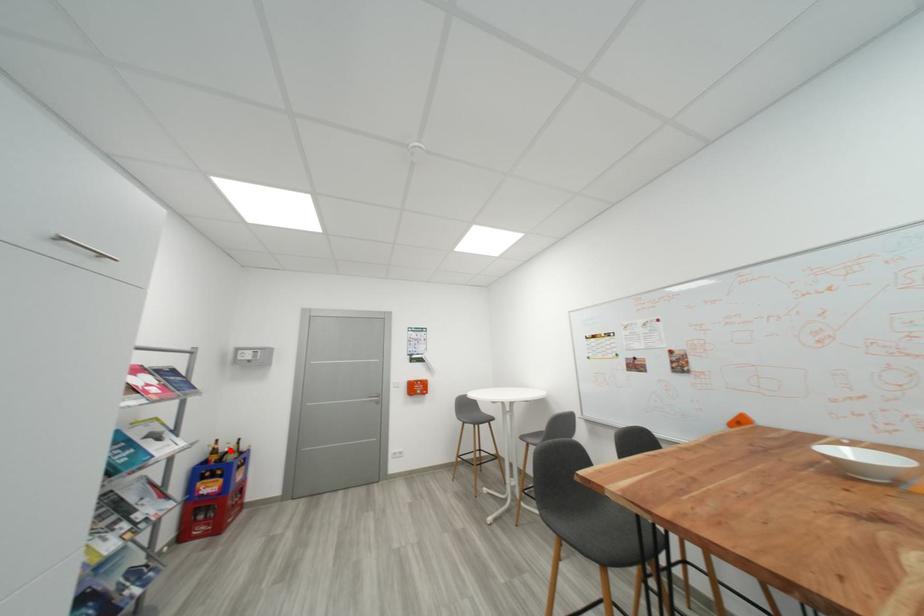
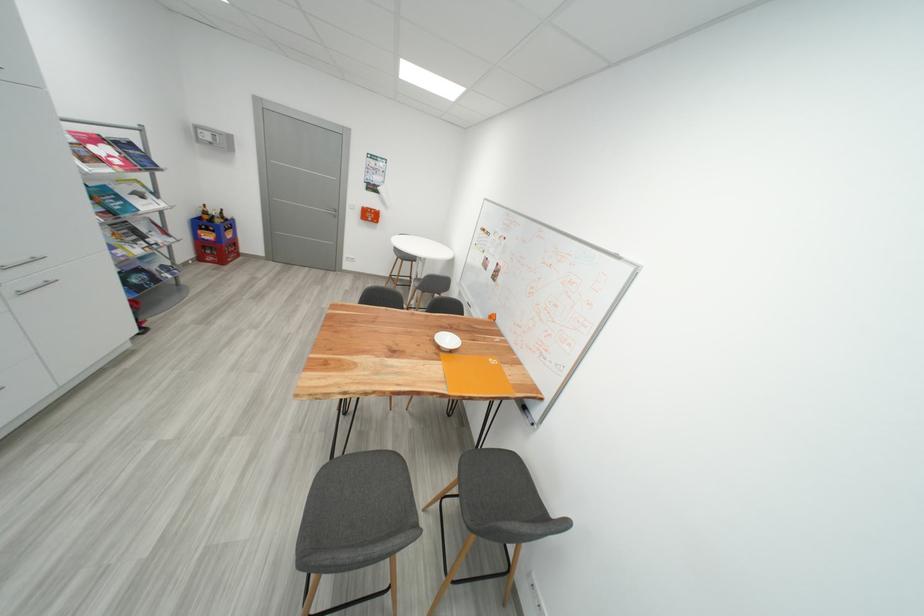
The point at the highlighted location is marked in the first image. Where is the corresponding point in the second image?

(220, 214)